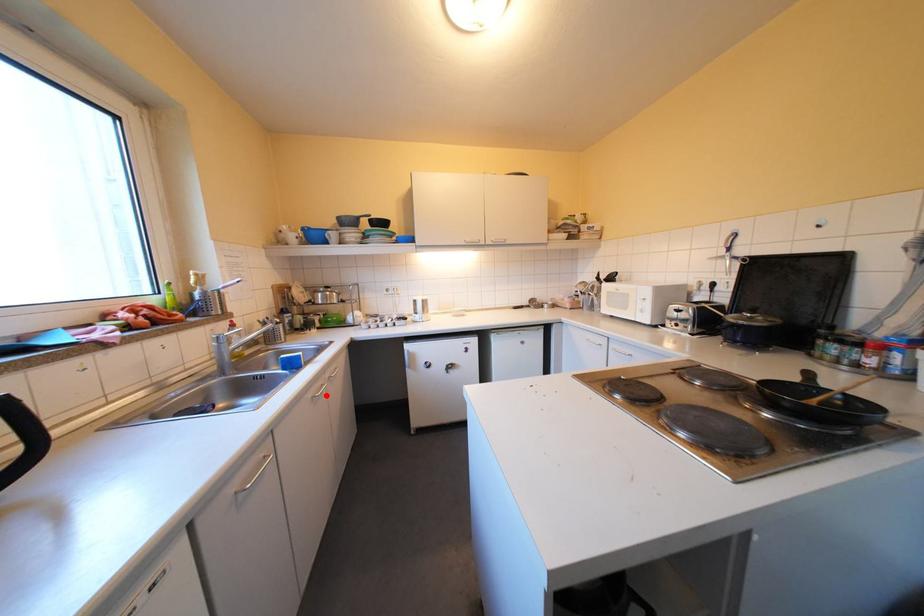
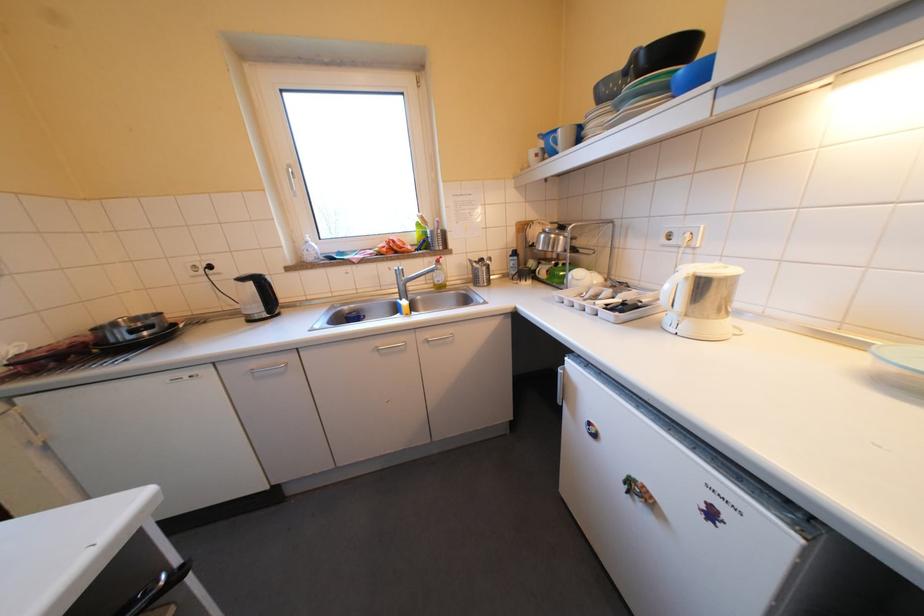
In the second image, find the point that corresponds to the highlighted location in the first image.

(391, 346)